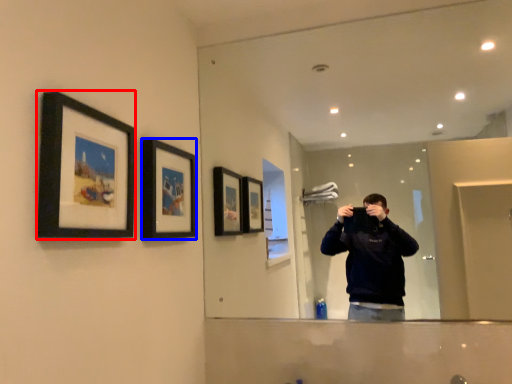
Question: Which object is further to the camera taking this photo, picture frame (highlighted by a red box) or picture frame (highlighted by a blue box)?

Choices:
 (A) picture frame
 (B) picture frame

Answer: (B)